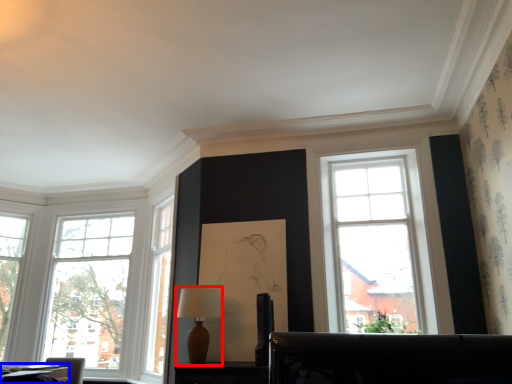
Question: Which of the following is the farthest to the observer, table lamp (highlighted by a red box) or table (highlighted by a blue box)?

Choices:
 (A) table lamp
 (B) table

Answer: (A)